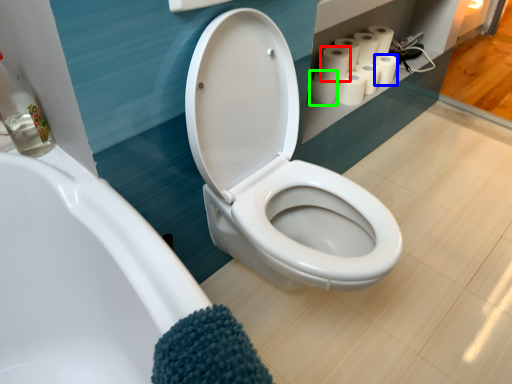
Question: Based on their relative distances, which object is farther from toilet paper (highlighted by a red box)? Choose from toilet paper (highlighted by a blue box) and toilet paper (highlighted by a green box).

Choices:
 (A) toilet paper
 (B) toilet paper

Answer: (A)